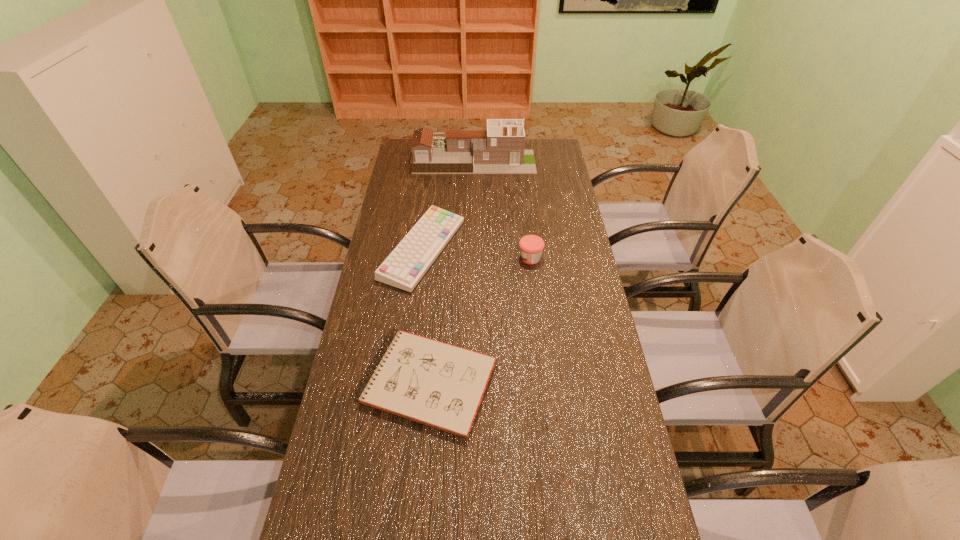
Choose which object is the nearest neighbor to the second tallest object. Please provide its 2D coordinates. Your answer should be formatted as a tuple, i.e. [(x, y)], where the tuple contains the x and y coordinates of a point satisfying the conditions above.

[(405, 266)]

Locate an element on the screen. Image resolution: width=960 pixels, height=540 pixels. free point that satisfies the following two spatial constraints: 1. at the main entrance of the dollhouse; 2. on the front side of the nearest object is located at coordinates (469, 383).

I want to click on vacant position in the image that satisfies the following two spatial constraints: 1. on the front side of the notepad; 2. on the left side of the third tallest object, so click(405, 383).

The height and width of the screenshot is (540, 960). What are the coordinates of `vacant position in the image that satisfies the following two spatial constraints: 1. on the front side of the nearest object; 2. on the left side of the third tallest object` in the screenshot? It's located at (405, 383).